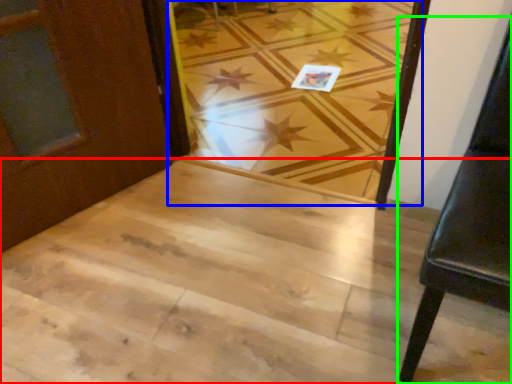
Question: Considering the real-world distances, which object is closest to stairwell (highlighted by a red box)? plank (highlighted by a blue box) or furniture (highlighted by a green box).

Choices:
 (A) plank
 (B) furniture

Answer: (B)